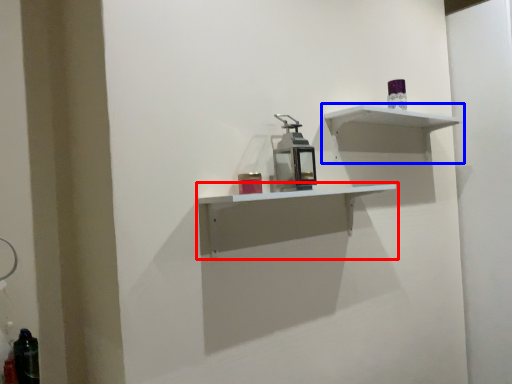
Question: Which point is further to the camera, shelf (highlighted by a red box) or shelf (highlighted by a blue box)?

Choices:
 (A) shelf
 (B) shelf

Answer: (B)